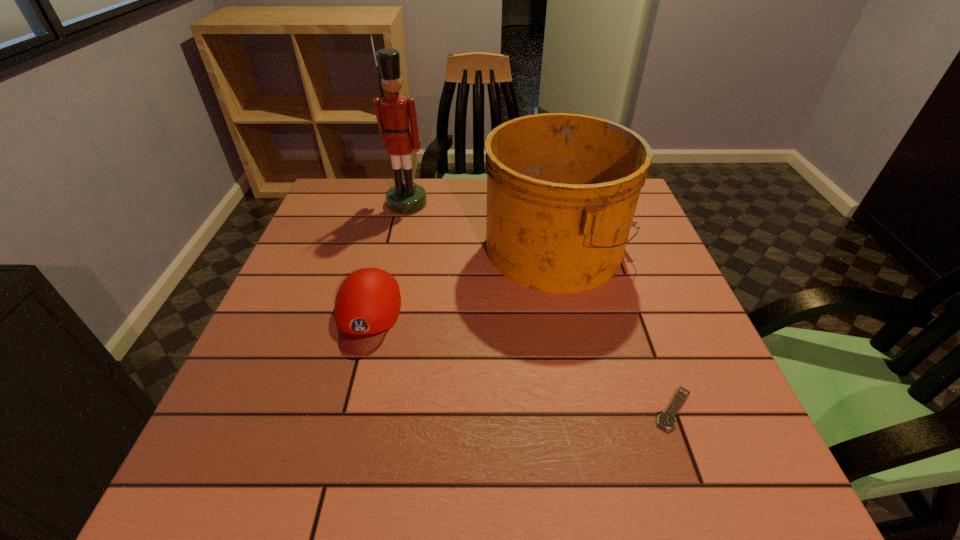
Where is `bucket located at the far edge`? The height and width of the screenshot is (540, 960). bucket located at the far edge is located at coordinates (562, 189).

Where is `object located in the left edge section of the desktop`? object located in the left edge section of the desktop is located at coordinates (368, 302).

You are a GUI agent. You are given a task and a screenshot of the screen. Output one action in this format:
    pyautogui.click(x=<x>, y=<y>)
    Task: Click on the bucket located in the right edge section of the desktop
    Image resolution: width=960 pixels, height=540 pixels.
    Given the screenshot: What is the action you would take?
    pyautogui.click(x=562, y=189)

Where is `watch located in the right edge section of the desktop`? watch located in the right edge section of the desktop is located at coordinates (667, 420).

Locate an element on the screen. This screenshot has height=540, width=960. object situated at the far right corner is located at coordinates (562, 189).

Find the location of a particular element. The height and width of the screenshot is (540, 960). free space at the near edge of the desktop is located at coordinates (318, 449).

This screenshot has height=540, width=960. In order to click on free space at the left edge of the desktop in this screenshot , I will do `click(364, 232)`.

In the image, there is a desktop. What are the coordinates of `blank space at the right edge` in the screenshot? It's located at (712, 434).

Where is `empty space between the third shortest object and the watch`? This screenshot has height=540, width=960. empty space between the third shortest object and the watch is located at coordinates (615, 328).

I want to click on vacant point located between the nutcracker and the third shortest object, so click(x=482, y=225).